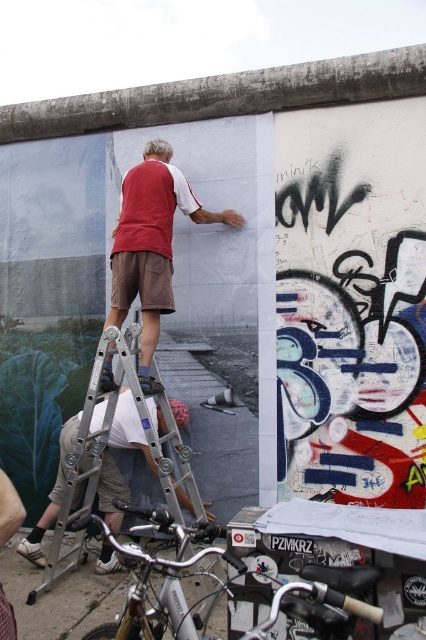
Can you confirm if silver metallic ladder at center is bigger than silver metallic bicycle at lower center?

Yes.

Is silver metallic ladder at center below silver metallic bicycle at lower center?

Incorrect, silver metallic ladder at center is not positioned below silver metallic bicycle at lower center.

What are the coordinates of `silver metallic ladder at center` in the screenshot? It's located at (112, 458).

Image resolution: width=426 pixels, height=640 pixels. What do you see at coordinates (164, 586) in the screenshot?
I see `silver metallic bicycle at lower center` at bounding box center [164, 586].

Between point (354, 612) and point (170, 147), which one is positioned behind?

Positioned behind is point (170, 147).

Find the location of a particular element. silver metallic bicycle at lower center is located at coordinates (164, 586).

Can you confirm if silver metallic ladder at center is thinner than matte red t-shirt at center?

No.

Who is positioned more to the left, silver metallic ladder at center or matte red t-shirt at center?

silver metallic ladder at center is more to the left.

Does point (134, 380) come behind point (132, 269)?

No, it is in front of (132, 269).

Image resolution: width=426 pixels, height=640 pixels. Identify the location of silver metallic ladder at center. (112, 458).